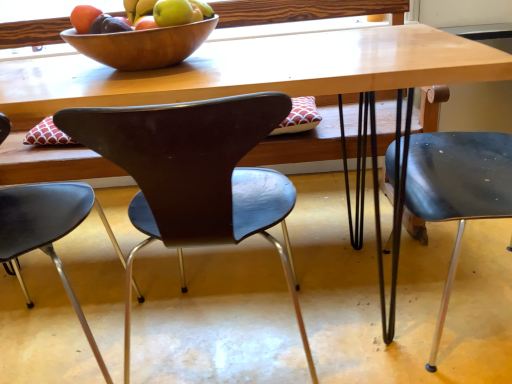
Question: Should I look upward or downward to see matte black chair at right, the 3th chair from the left?

Choices:
 (A) up
 (B) down

Answer: (A)

Question: Is wooden bowl at upper center to the left of matte black chair at right, acting as the 1th chair starting from the right, from the viewer's perspective?

Choices:
 (A) no
 (B) yes

Answer: (B)

Question: Is matte black chair at right, acting as the 1th chair starting from the right, inside wooden bowl at upper center?

Choices:
 (A) no
 (B) yes

Answer: (A)

Question: Considering the relative positions of wooden bowl at upper center and matte black chair at right, the 3th chair from the left, in the image provided, is wooden bowl at upper center to the right of matte black chair at right, the 3th chair from the left, from the viewer's perspective?

Choices:
 (A) yes
 (B) no

Answer: (B)

Question: Does wooden bowl at upper center lie in front of matte black chair at right, the 3th chair from the left?

Choices:
 (A) no
 (B) yes

Answer: (A)

Question: Can you confirm if wooden bowl at upper center is smaller than matte black chair at right, the 3th chair from the left?

Choices:
 (A) no
 (B) yes

Answer: (B)

Question: Does wooden bowl at upper center turn towards matte black chair at right, the 3th chair from the left?

Choices:
 (A) no
 (B) yes

Answer: (A)

Question: Is matte brown chair at center, the 2th chair in the right-to-left sequence, to the left of wooden bowl at upper center from the viewer's perspective?

Choices:
 (A) no
 (B) yes

Answer: (A)

Question: Does matte brown chair at center, the 2th chair in the right-to-left sequence, have a lesser height compared to wooden bowl at upper center?

Choices:
 (A) no
 (B) yes

Answer: (A)

Question: Would you say wooden bowl at upper center is part of matte brown chair at center, marked as the 2th chair in a left-to-right arrangement,'s contents?

Choices:
 (A) no
 (B) yes

Answer: (A)

Question: Is the depth of matte brown chair at center, the 2th chair in the right-to-left sequence, less than that of wooden bowl at upper center?

Choices:
 (A) no
 (B) yes

Answer: (B)

Question: Does matte brown chair at center, the 2th chair in the right-to-left sequence, come behind wooden bowl at upper center?

Choices:
 (A) no
 (B) yes

Answer: (A)

Question: From a real-world perspective, is matte brown chair at center, the 2th chair in the right-to-left sequence, below wooden bowl at upper center?

Choices:
 (A) no
 (B) yes

Answer: (B)

Question: Can you confirm if matte brown chair at center, the 2th chair in the right-to-left sequence, is wider than matte black chair at right, acting as the 1th chair starting from the right?

Choices:
 (A) yes
 (B) no

Answer: (B)